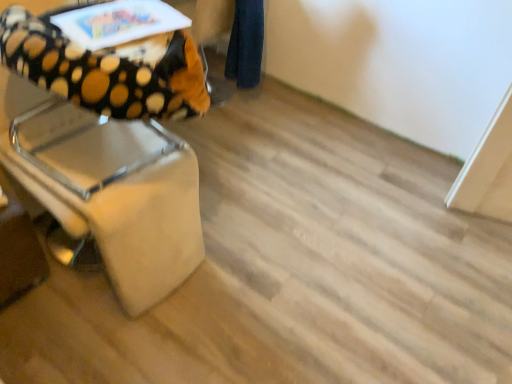
What do you see at coordinates (108, 187) in the screenshot?
I see `beige leather chair at left` at bounding box center [108, 187].

At what (x,y) coordinates should I click in order to perform the action: click on beige leather chair at left. Please return your answer as a coordinate pair (x, y). The height and width of the screenshot is (384, 512). Looking at the image, I should click on (108, 187).

This screenshot has height=384, width=512. In order to click on beige leather chair at left in this screenshot , I will do `click(108, 187)`.